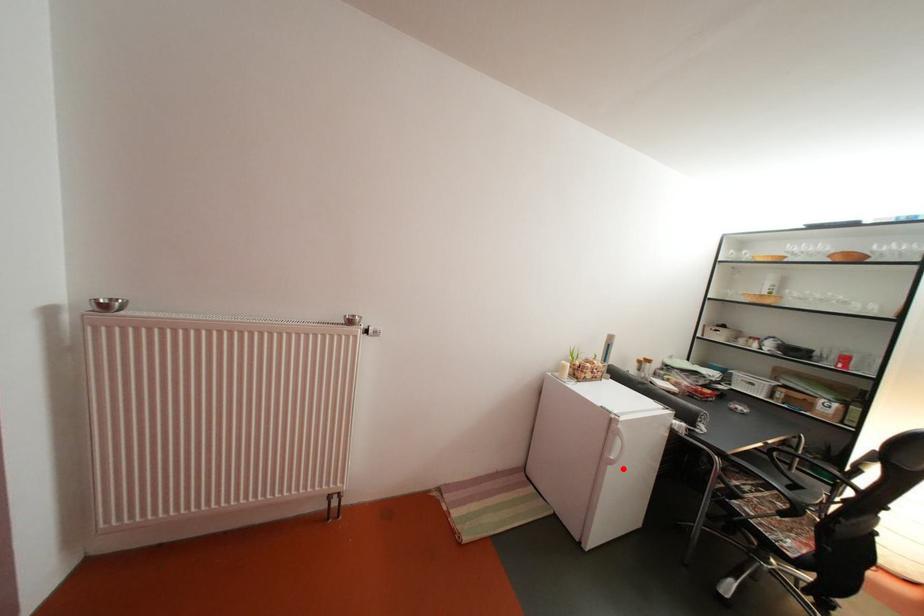
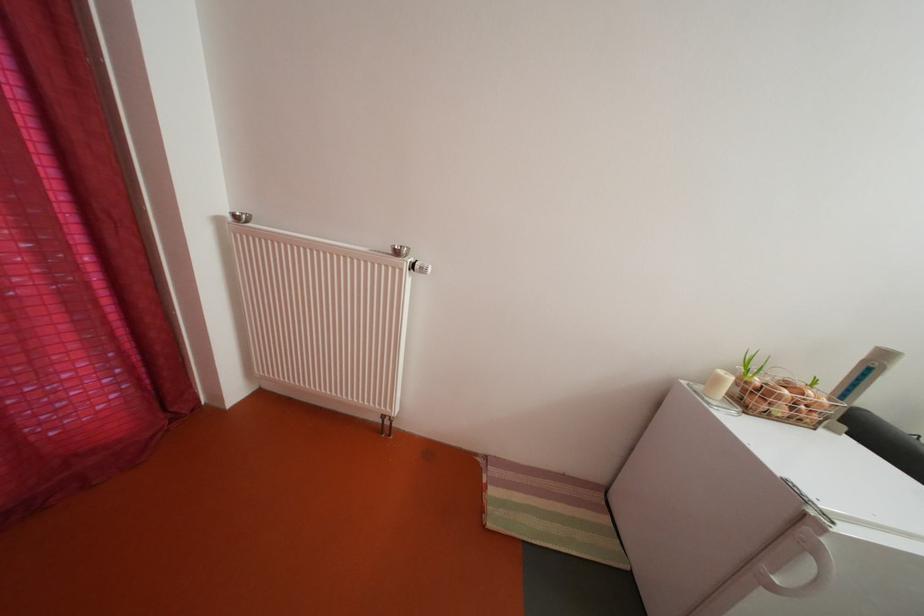
In the second image, find the point that corresponds to the highlighted location in the first image.

(784, 594)